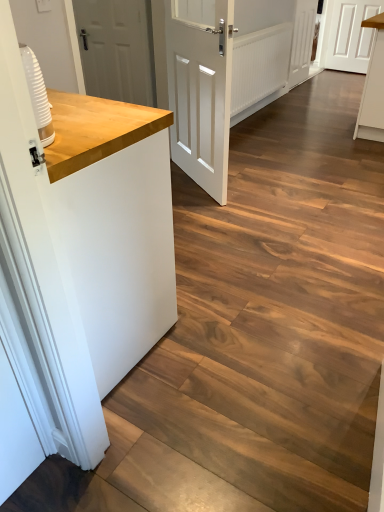
Locate an element on the screen. Image resolution: width=384 pixels, height=512 pixels. vacant area that is situated to the right of wooden countertop at left is located at coordinates (226, 328).